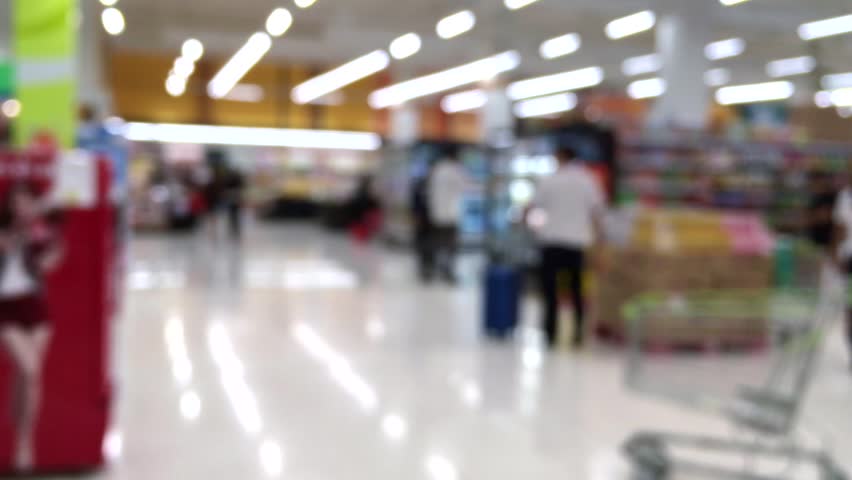
At what (x,y) coordinates should I click in order to perform the action: click on ceiling. Please return your answer as a coordinate pair (x, y). Looking at the image, I should click on (358, 13).